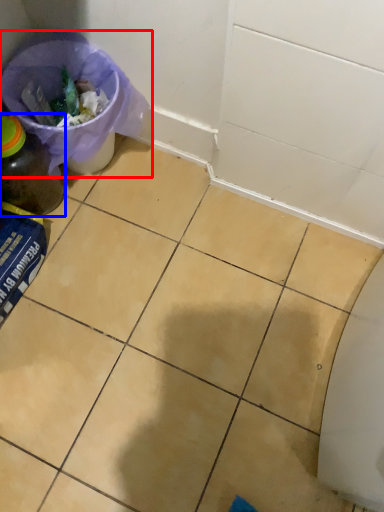
Question: Among these objects, which one is farthest to the camera, recycling bin (highlighted by a red box) or bottle (highlighted by a blue box)?

Choices:
 (A) recycling bin
 (B) bottle

Answer: (A)